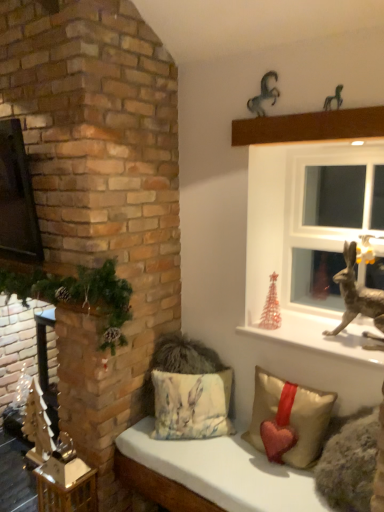
At what (x,y) coordinates should I click in order to perform the action: click on free point below beige fabric pillow with heart at lower center, the 1th pillow in the right-to-left sequence (from a real-world perspective). Please return your answer as a coordinate pair (x, y). This screenshot has height=512, width=384. Looking at the image, I should click on (271, 463).